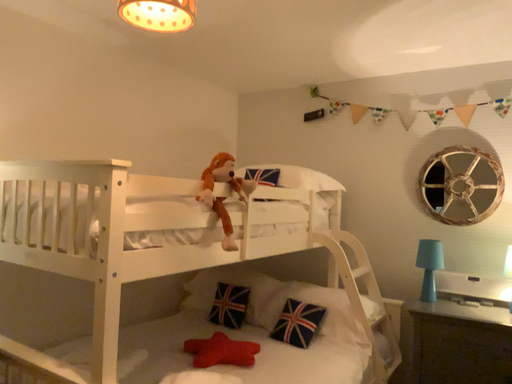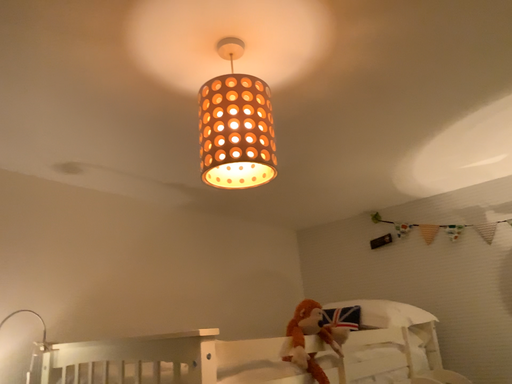
Question: Which way did the camera rotate in the video?

Choices:
 (A) rotated left
 (B) rotated right

Answer: (A)